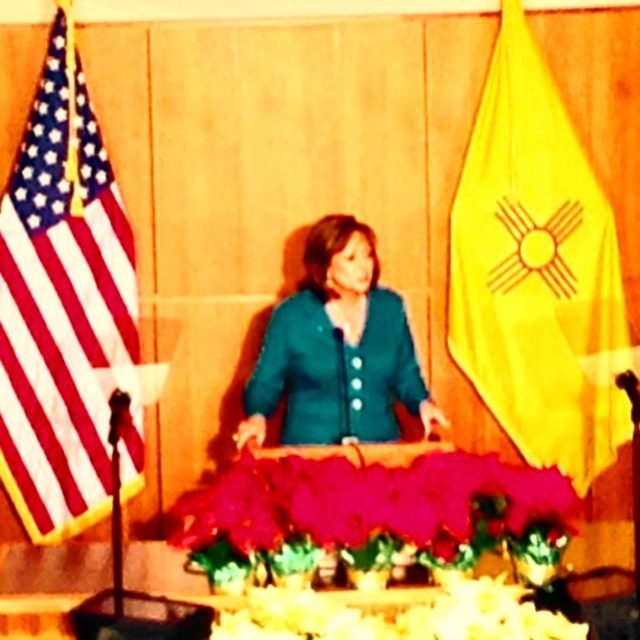
Based on the photo, you are organizing a photo shoot and need to ensure that the yellow fabric flag at right and the white matte flowers at lower center are framed properly. Which object should be placed closer to the camera to maintain their relative sizes as seen in the image?

The yellow fabric flag at right has a lesser width compared to the white matte flowers at lower center. To maintain their relative sizes, the yellow fabric flag at right should be placed closer to the camera since it is smaller and needs to appear proportionally similar in size to the larger white matte flowers at lower center when viewed from the camera position.

You are an event planner arranging a photo shoot at this formal event. You want to ensure the silky pink petals at center and the teal fabric jacket at center are visible in the photo. Which object should you focus on to ensure both are in frame?

To ensure both the silky pink petals at center and the teal fabric jacket at center are visible, focus on the teal fabric jacket at center because the silky pink petals at center are in front of it, making them naturally visible when the jacket is in frame.